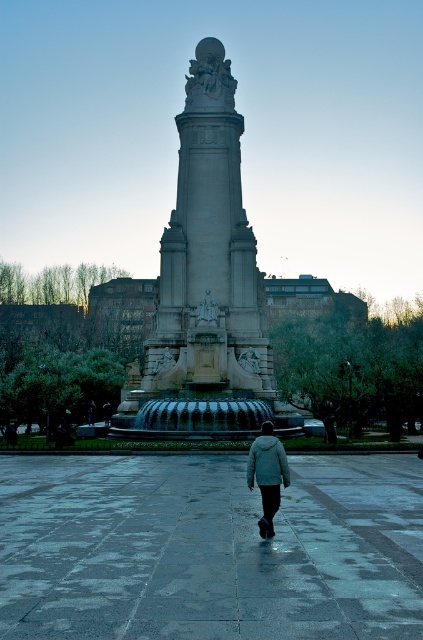
Measure the distance between point (206, 209) and camera.

A distance of 352.99 feet exists between point (206, 209) and camera.

This screenshot has width=423, height=640. What are the coordinates of `gray stone monument at center` in the screenshot? It's located at (206, 285).

What do you see at coordinates (206, 285) in the screenshot?
I see `gray stone monument at center` at bounding box center [206, 285].

This screenshot has height=640, width=423. Find the location of `gray stone monument at center`. gray stone monument at center is located at coordinates (206, 285).

Between gray stone monument at center and light gray woolen jacket at center, which one is positioned higher?

gray stone monument at center

Can you confirm if gray stone monument at center is positioned to the left of light gray woolen jacket at center?

Yes, gray stone monument at center is to the left of light gray woolen jacket at center.

Identify the location of gray stone monument at center. (206, 285).

Locate an element on the screen. The width and height of the screenshot is (423, 640). gray stone monument at center is located at coordinates (206, 285).

Is light gray woolen jacket at center smaller than green matte jacket at lower center?

No.

Between light gray woolen jacket at center and green matte jacket at lower center, which one appears on the right side from the viewer's perspective?

green matte jacket at lower center

Is point (268, 522) positioned behind point (260, 444)?

No.

Find the location of a particular element. light gray woolen jacket at center is located at coordinates (268, 474).